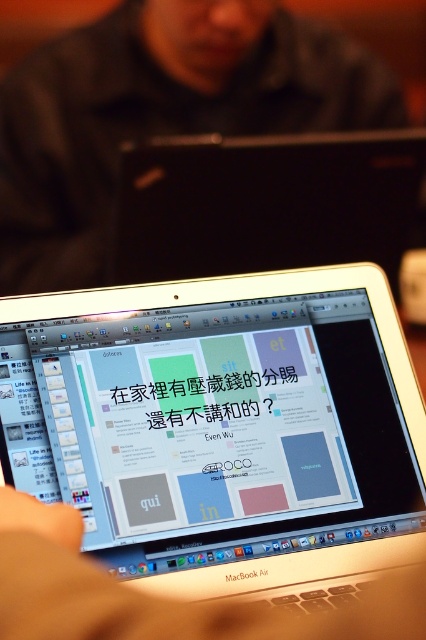
You are a photographer taking a picture of the scene. You want to focus on the black matte laptop at center and the white plastic laptop at center. Which one should you adjust your camera focus to first to ensure both are in focus?

You should focus on the black matte laptop at center first because it is closer to you than the white plastic laptop at center. By focusing on the closer object, the background object may still be in focus depending on the depth of field.

You are a graphic designer working on a project. You have two laptops, a silver metallic laptop at center and a black matte laptop at center. You need to choose the one that is easier to carry for a meeting. Which one should you choose?

The silver metallic laptop at center is thinner than the black matte laptop at center, so it is easier to carry for a meeting.